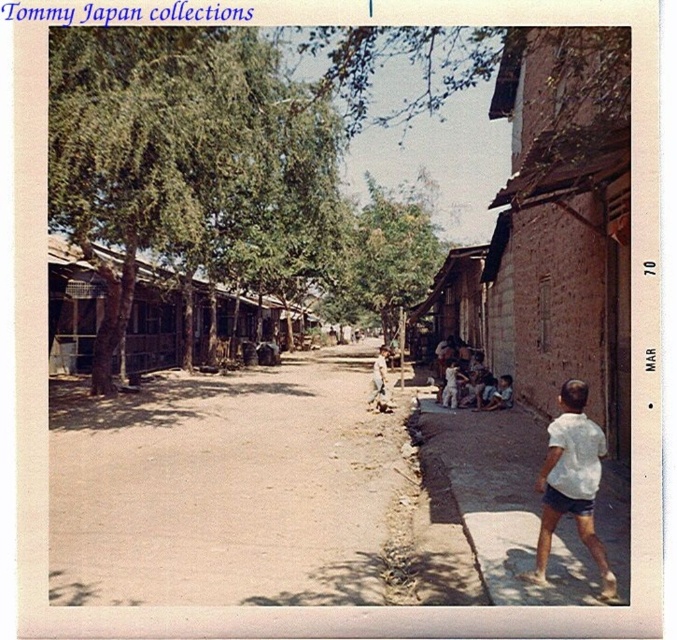
Which is below, brown wooden hut at center or brown wooden hut at center-right?

brown wooden hut at center

Which is behind, point (261, 308) or point (456, 310)?

The point (261, 308) is behind.

I want to click on brown wooden hut at center, so click(x=72, y=307).

Is dirt ground at center wider than brown brick hut at right?

Yes.

Between dirt ground at center and brown brick hut at right, which one has less height?

With less height is dirt ground at center.

Between point (204, 490) and point (617, 392), which one is positioned behind?

Positioned behind is point (617, 392).

At what (x,y) coordinates should I click in order to perform the action: click on dirt ground at center. Please return your answer as a coordinate pair (x, y). Looking at the image, I should click on (225, 488).

Is point (450, 444) more distant than point (376, 401)?

No, (450, 444) is in front of (376, 401).

Is white cotton shirt at lower right to the right of light brown wooden stick at center from the viewer's perspective?

Yes, white cotton shirt at lower right is to the right of light brown wooden stick at center.

Find the location of a particular element. The image size is (677, 640). white cotton shirt at lower right is located at coordinates (525, 499).